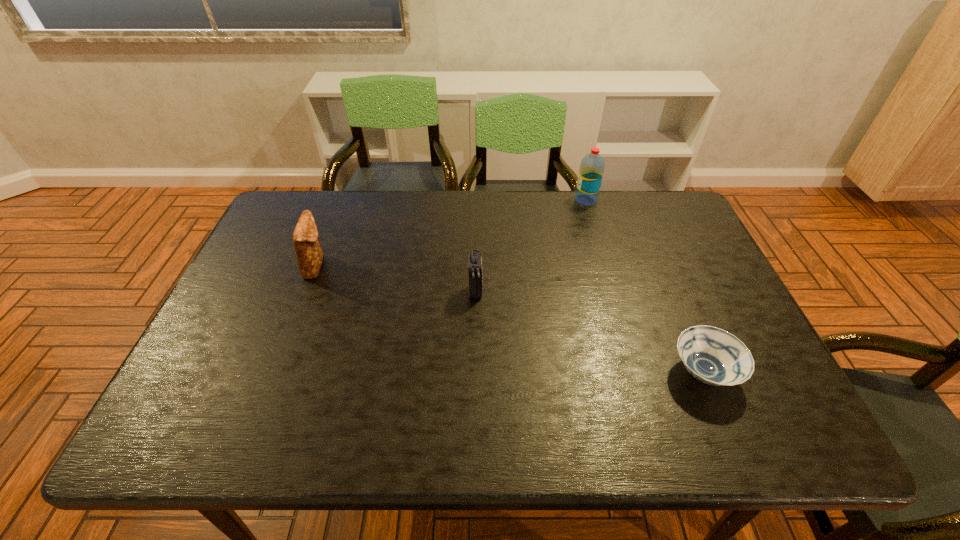
The image size is (960, 540). I want to click on vacant space at the far right corner of the desktop, so click(x=662, y=192).

Locate an element on the screen. vacant space that's between the tallest object and the second shortest object is located at coordinates (531, 245).

Find the location of `vacant area that lies between the nearest object and the right clutch bag`. vacant area that lies between the nearest object and the right clutch bag is located at coordinates (589, 332).

Find the location of a particular element. This screenshot has width=960, height=540. free point between the leftmost object and the second object from right to left is located at coordinates (450, 233).

Find the location of a particular element. The width and height of the screenshot is (960, 540). vacant space that is in between the left clutch bag and the tallest object is located at coordinates (450, 233).

This screenshot has height=540, width=960. I want to click on vacant area between the third tallest object and the left clutch bag, so click(396, 278).

This screenshot has width=960, height=540. In order to click on free space between the third object from left to right and the leftmost object in this screenshot , I will do 450,233.

Where is `free spot between the shorter clutch bag and the left clutch bag`? This screenshot has width=960, height=540. free spot between the shorter clutch bag and the left clutch bag is located at coordinates (396, 278).

You are a GUI agent. You are given a task and a screenshot of the screen. Output one action in this format:
    pyautogui.click(x=<x>, y=<y>)
    Task: Click on the vacant point located between the left clutch bag and the second object from right to left
    The width and height of the screenshot is (960, 540).
    Given the screenshot: What is the action you would take?
    pyautogui.click(x=450, y=233)

Where is `unoccupied area between the second object from right to left and the right clutch bag`? Image resolution: width=960 pixels, height=540 pixels. unoccupied area between the second object from right to left and the right clutch bag is located at coordinates (531, 245).